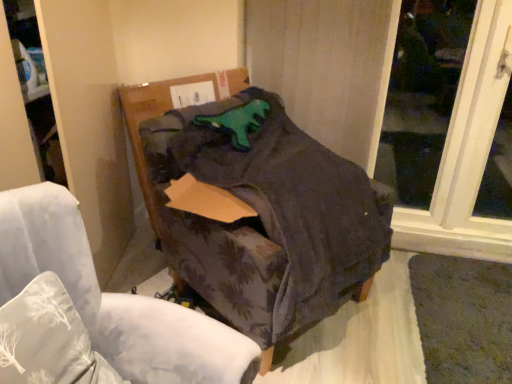
Question: In the image, is transparent glass window at upper right on the left side or the right side of dark fabric chair at center?

Choices:
 (A) left
 (B) right

Answer: (B)

Question: Relative to dark fabric chair at center, is transparent glass window at upper right in front or behind?

Choices:
 (A) behind
 (B) front

Answer: (A)

Question: Considering the real-world distances, which object is closest to the white fabric pillow at lower left?

Choices:
 (A) purple floral fabric chair at center
 (B) cardboard box at center
 (C) dark fabric chair at center
 (D) transparent glass window at upper right

Answer: (A)

Question: Estimate the real-world distances between objects in this image. Which object is farther from the cardboard box at center?

Choices:
 (A) purple floral fabric chair at center
 (B) white fabric pillow at lower left
 (C) transparent glass window at upper right
 (D) dark fabric chair at center

Answer: (C)